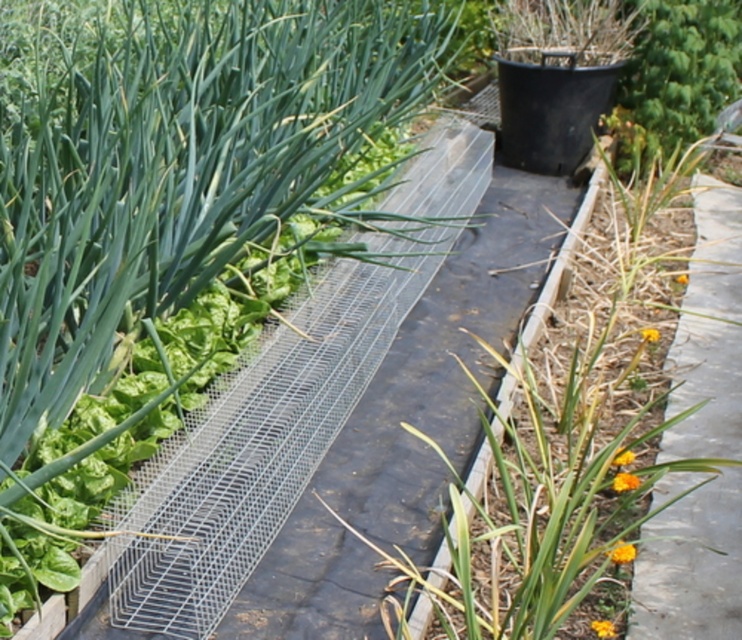
You are a gardener who wants to walk from the garden bed to the smooth concrete path at right without stepping on the green leafy at center. Can you do it? Please explain.

The green leafy at center and smooth concrete path at right are 7.88 inches apart. Since the distance between them is only 7.88 inches, you can easily step over the green leafy at center to reach the smooth concrete path at right without stepping on it.

You are a gardener who wants to plant a new row of carrots. The carrot seeds require a planting space that is at least as wide as the smooth concrete path at right. Can the green leafy at center provide enough width for this requirement?

The green leafy at center has a width larger than the smooth concrete path at right, so yes, it can provide enough space for planting the carrots as the required width is met or exceeded.

You are a gardener planning to plant a new row of herbs between the green leafy at center and the smooth concrete path at right. Given their sizes, which object should you place closer to the path to ensure enough space for the herbs?

The green leafy at center is larger in size than the smooth concrete path at right, so you should place the herbs closer to the smooth concrete path at right to ensure sufficient space for the larger green leafy at center.